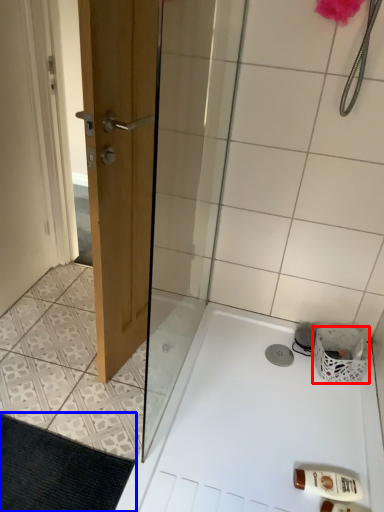
Question: Which object appears closest to the camera in this image, basket (highlighted by a red box) or bath mat (highlighted by a blue box)?

Choices:
 (A) basket
 (B) bath mat

Answer: (B)